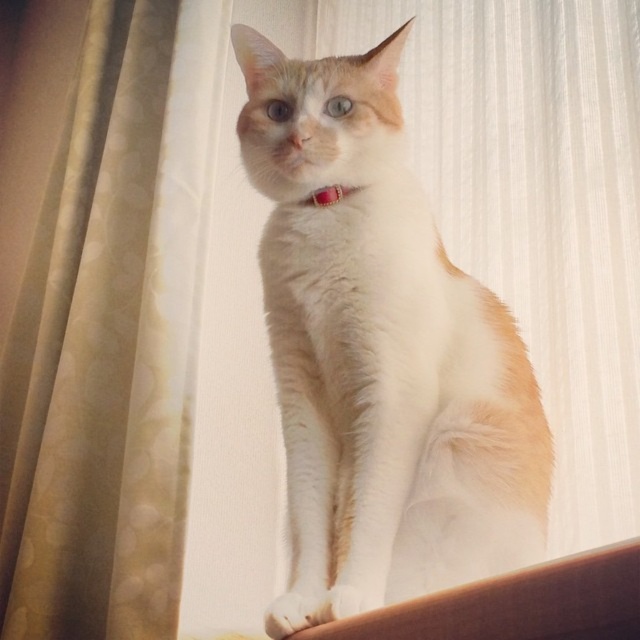
Between white fur cat at center and rubber band at center, which one is positioned lower?

white fur cat at center

Between white fur cat at center and rubber band at center, which one appears on the left side from the viewer's perspective?

From the viewer's perspective, rubber band at center appears more on the left side.

Is point (529, 371) farther from viewer compared to point (332, 202)?

No, it is not.

This screenshot has height=640, width=640. I want to click on white fur cat at center, so click(380, 353).

Does point (364, 145) come farther from viewer compared to point (97, 1)?

No.

At what (x,y) coordinates should I click in order to perform the action: click on white fur cat at center. Please return your answer as a coordinate pair (x, y). Image resolution: width=640 pixels, height=640 pixels. Looking at the image, I should click on (380, 353).

What are the coordinates of `white fur cat at center` in the screenshot? It's located at (380, 353).

Is beige textured curtain at left to the right of rubber band at center from the viewer's perspective?

No, beige textured curtain at left is not to the right of rubber band at center.

Between beige textured curtain at left and rubber band at center, which one is positioned lower?

beige textured curtain at left

Is point (115, 152) positioned before point (324, 196)?

No, (115, 152) is further to viewer.

Locate an element on the screen. The height and width of the screenshot is (640, 640). beige textured curtain at left is located at coordinates (109, 339).